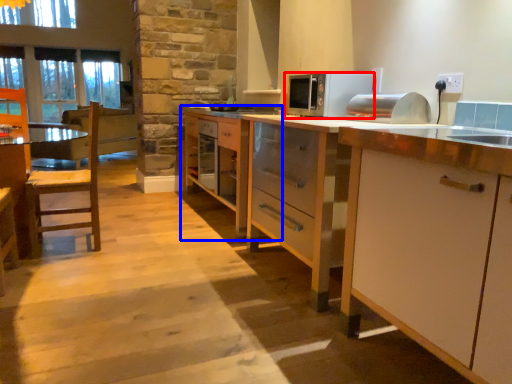
Question: Among these objects, which one is nearest to the camera, microwave oven (highlighted by a red box) or cabinetry (highlighted by a blue box)?

Choices:
 (A) microwave oven
 (B) cabinetry

Answer: (A)